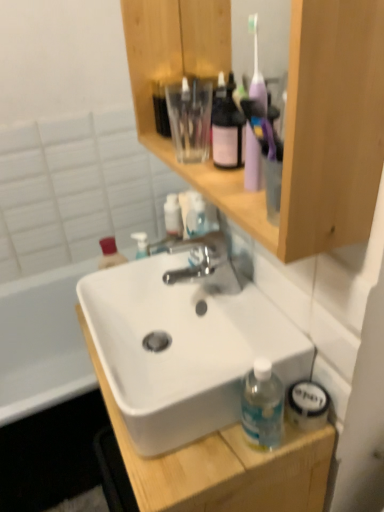
This screenshot has width=384, height=512. Find the location of `wooden cabinet at upper center`. wooden cabinet at upper center is located at coordinates (289, 122).

From a real-world perspective, does wooden cabinet at upper center stand above polished chrome faucet at center?

Indeed, from a real-world perspective, wooden cabinet at upper center stands above polished chrome faucet at center.

How different are the orientations of wooden cabinet at upper center and polished chrome faucet at center in degrees?

The angular difference between wooden cabinet at upper center and polished chrome faucet at center is 0.314 degrees.

At what (x,y) coordinates should I click in order to perform the action: click on bathroom cabinet above the polished chrome faucet at center (from a real-world perspective). Please return your answer as a coordinate pair (x, y). The width and height of the screenshot is (384, 512). Looking at the image, I should click on (289, 122).

Is wooden cabinet at upper center bigger or smaller than polished chrome faucet at center?

In the image, wooden cabinet at upper center appears to be larger than polished chrome faucet at center.

Which is correct: polished chrome faucet at center is inside wooden cabinet at upper center, or outside of it?

polished chrome faucet at center is located beyond the bounds of wooden cabinet at upper center.

Can you confirm if polished chrome faucet at center is positioned to the left of wooden cabinet at upper center?

Yes, polished chrome faucet at center is to the left of wooden cabinet at upper center.

Who is smaller, polished chrome faucet at center or wooden cabinet at upper center?

With smaller size is polished chrome faucet at center.

From the image's perspective, is polished chrome faucet at center below wooden cabinet at upper center?

Yes.

Who is shorter, white matte sink at center or polished chrome faucet at center?

With less height is polished chrome faucet at center.

From a real-world perspective, relative to polished chrome faucet at center, is white matte sink at center vertically above or below?

From a real-world perspective, white matte sink at center is physically below polished chrome faucet at center.

Who is more distant, white matte sink at center or polished chrome faucet at center?

polished chrome faucet at center is further from the camera.

Which object is positioned more to the left, polished chrome faucet at center or white matte sink at center?

From the viewer's perspective, white matte sink at center appears more on the left side.

This screenshot has width=384, height=512. Find the location of `cabinetry in front of the polished chrome faucet at center`. cabinetry in front of the polished chrome faucet at center is located at coordinates (223, 466).

Is polished chrome faucet at center aimed at white matte sink at center?

No.

Considering the sizes of polished chrome faucet at center and white matte sink at center in the image, is polished chrome faucet at center taller or shorter than white matte sink at center?

Clearly, polished chrome faucet at center is shorter compared to white matte sink at center.

From a real-world perspective, is wooden cabinet at upper center over white matte sink at center?

Yes, from a real-world perspective, wooden cabinet at upper center is over white matte sink at center

Is wooden cabinet at upper center beside white matte sink at center?

There is a gap between wooden cabinet at upper center and white matte sink at center.

Is wooden cabinet at upper center thinner than white matte sink at center?

Indeed, wooden cabinet at upper center has a lesser width compared to white matte sink at center.

From the image's perspective, relative to white matte sink at center, is wooden cabinet at upper center above or below?

wooden cabinet at upper center is above white matte sink at center.

Is white matte sink at center facing away from wooden cabinet at upper center?

That's not correct — white matte sink at center is not looking away from wooden cabinet at upper center.

From the image's perspective, which one is positioned higher, white matte sink at center or wooden cabinet at upper center?

wooden cabinet at upper center, from the image's perspective.

Between white matte sink at center and wooden cabinet at upper center, which one has larger width?

white matte sink at center is wider.

This screenshot has height=512, width=384. Identify the location of cabinetry below the wooden cabinet at upper center (from a real-world perspective). (223, 466).

Locate an element on the screen. tap on the left of the wooden cabinet at upper center is located at coordinates (206, 264).

Find the location of `bathroom cabinet on the right of polished chrome faucet at center`. bathroom cabinet on the right of polished chrome faucet at center is located at coordinates (289, 122).

When comparing their distances from white matte sink at center, does wooden cabinet at upper center or polished chrome faucet at center seem further?

Based on the image, wooden cabinet at upper center appears to be further to white matte sink at center.

Estimate the real-world distances between objects in this image. Which object is closer to white matte sink at center, polished chrome faucet at center or wooden cabinet at upper center?

The object closer to white matte sink at center is polished chrome faucet at center.

Which object lies nearer to the anchor point polished chrome faucet at center, wooden cabinet at upper center or white matte sink at center?

Based on the image, wooden cabinet at upper center appears to be nearer to polished chrome faucet at center.

Looking at the image, which one is located further to wooden cabinet at upper center, white matte sink at center or polished chrome faucet at center?

white matte sink at center lies further to wooden cabinet at upper center than the other object.

Based on the photo, which object lies further to the anchor point polished chrome faucet at center, white matte sink at center or wooden cabinet at upper center?

The object further to polished chrome faucet at center is white matte sink at center.

When comparing their distances from wooden cabinet at upper center, does polished chrome faucet at center or white matte sink at center seem further?

The object further to wooden cabinet at upper center is white matte sink at center.

Where is `tap between wooden cabinet at upper center and white matte sink at center in the up-down direction`? This screenshot has height=512, width=384. tap between wooden cabinet at upper center and white matte sink at center in the up-down direction is located at coordinates (206, 264).